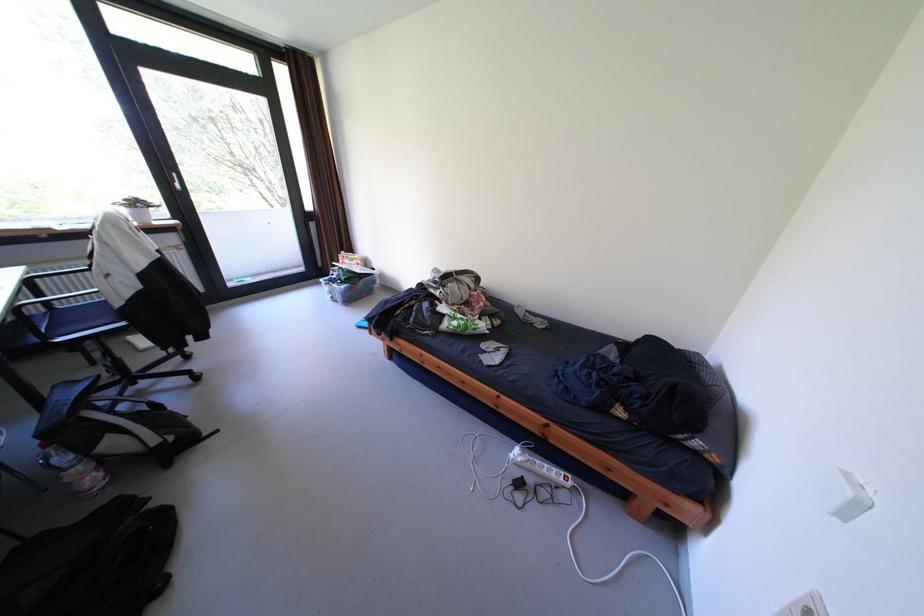
This screenshot has width=924, height=616. What are the coordinates of `sofa sitting surface` in the screenshot? It's located at (517, 357).